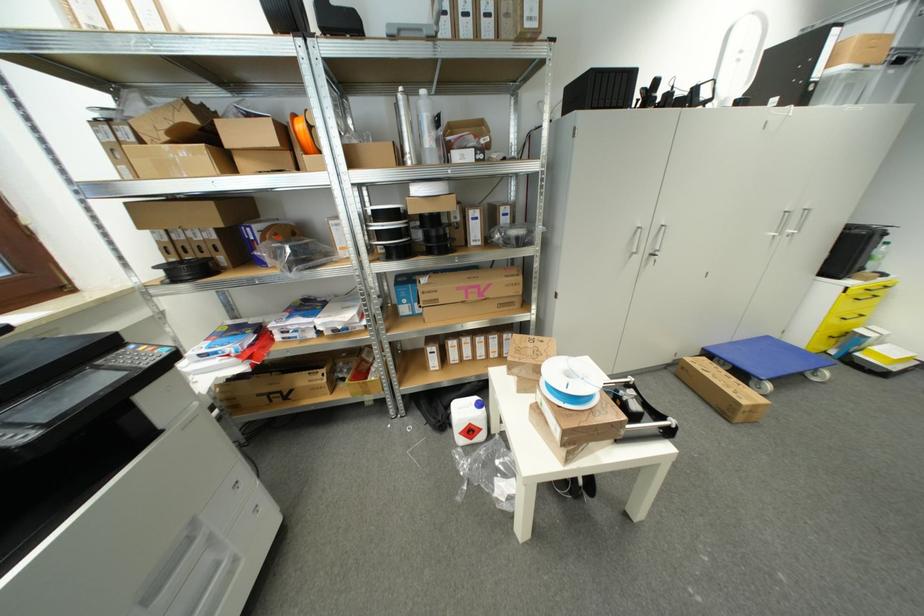
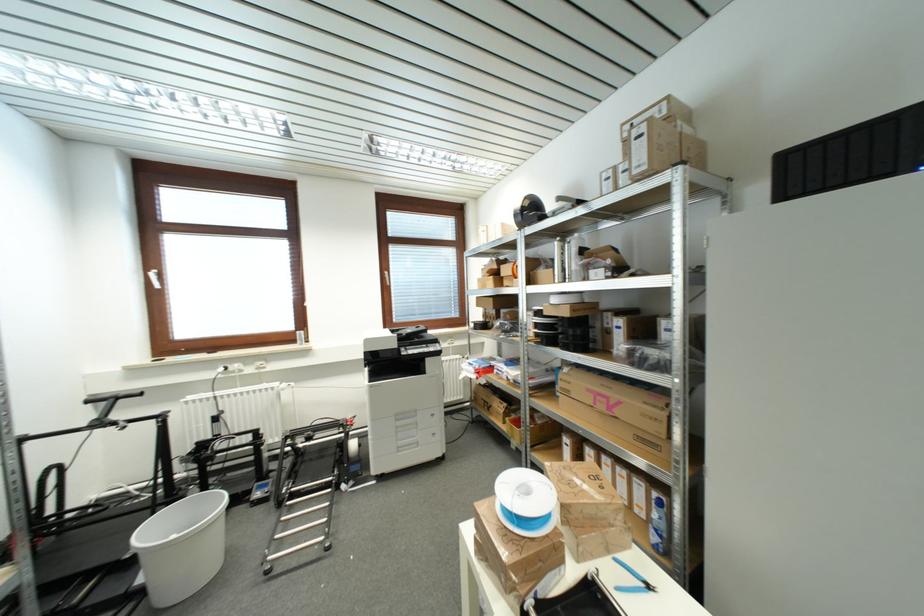
In the second image, find the point that corresponds to pixel 541 26 in the first image.

(650, 169)